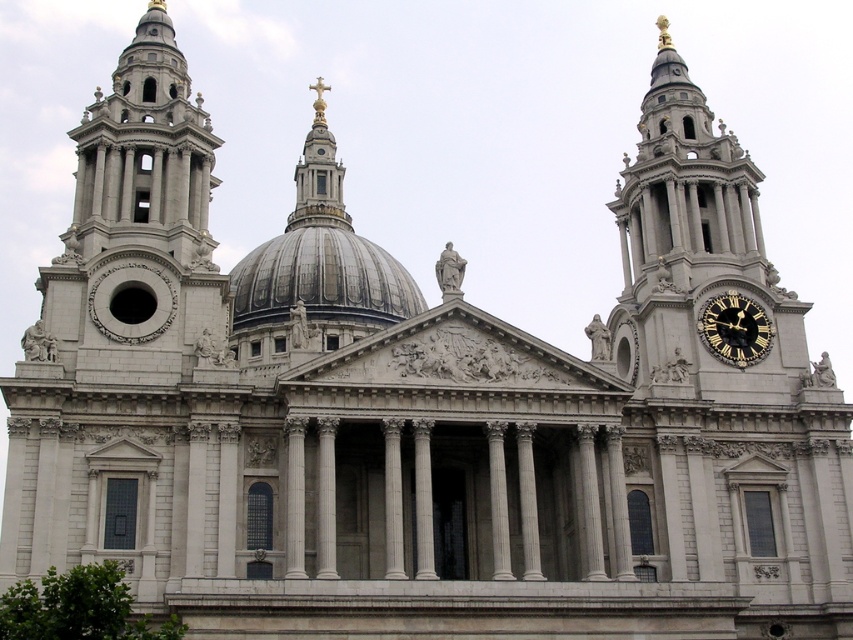
Question: Can you confirm if shiny silver dome at center is wider than black polished wood clock at right?

Choices:
 (A) yes
 (B) no

Answer: (A)

Question: Is shiny silver dome at center in front of black polished wood clock at right?

Choices:
 (A) yes
 (B) no

Answer: (B)

Question: Is shiny silver dome at center thinner than black polished wood clock at right?

Choices:
 (A) no
 (B) yes

Answer: (A)

Question: Which of the following is the farthest from the observer?

Choices:
 (A) (762, 353)
 (B) (322, 237)

Answer: (B)

Question: Which point is farther to the camera?

Choices:
 (A) (375, 305)
 (B) (741, 342)

Answer: (A)